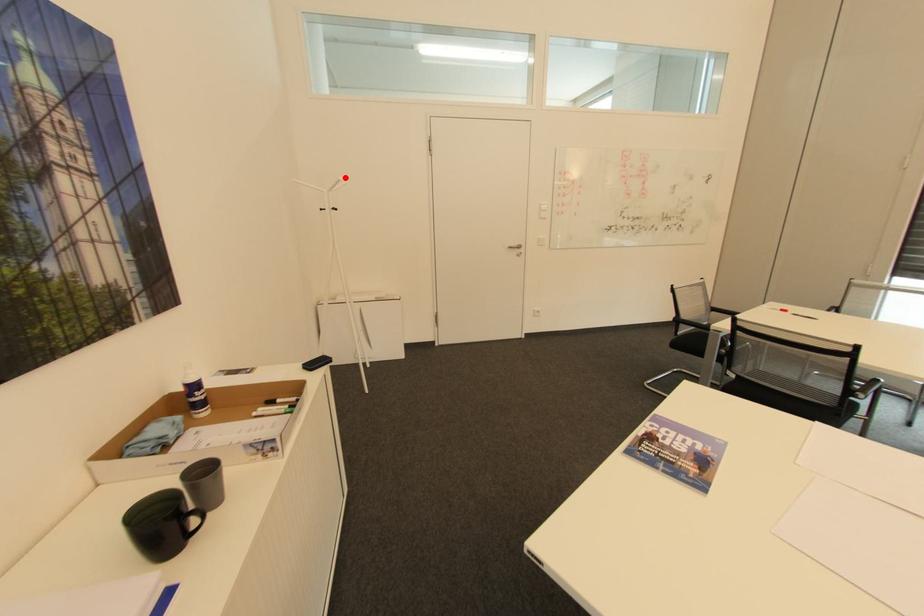
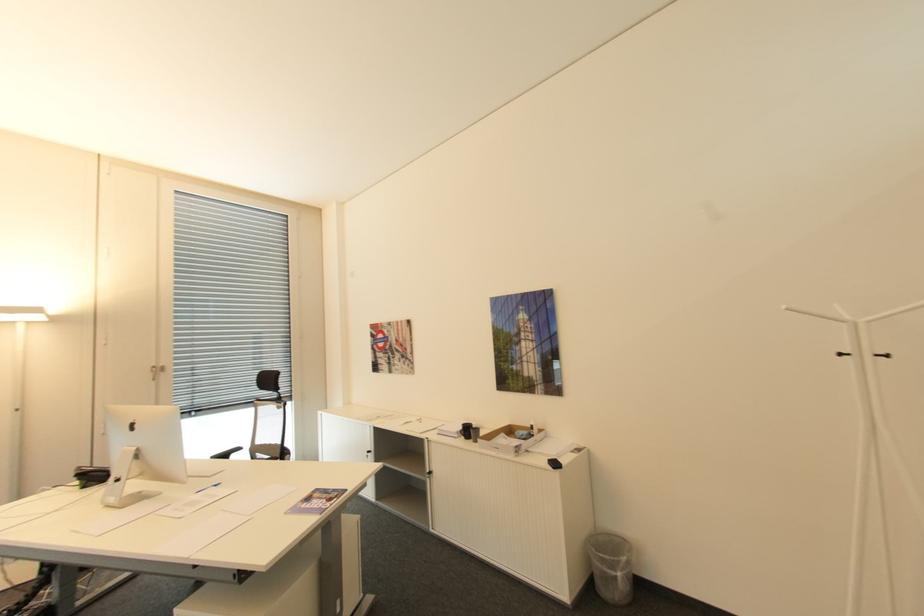
Where in the second image is the point corresponding to the highlighted location from the first image?

(791, 307)